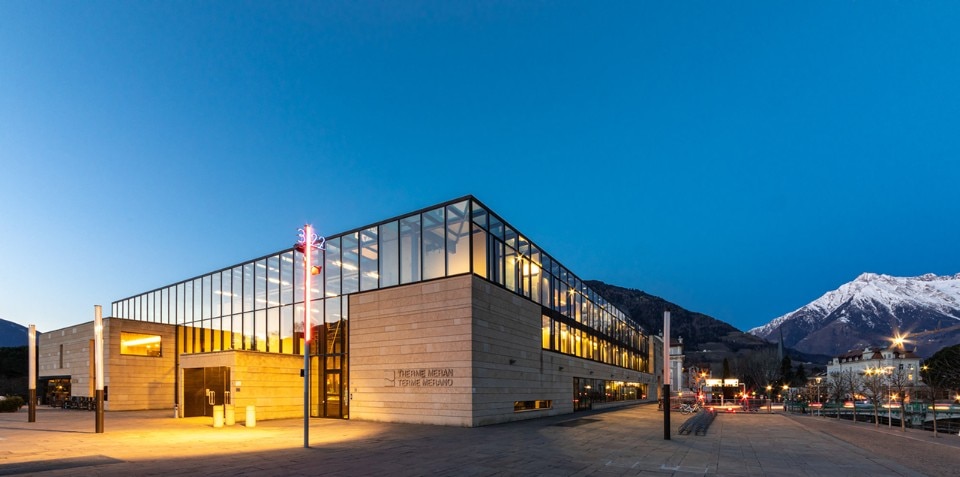
Where is `windows`? This screenshot has width=960, height=477. windows is located at coordinates (614, 354), (612, 322), (570, 349), (541, 284), (634, 402), (392, 276), (269, 292), (255, 336), (149, 350), (328, 408).